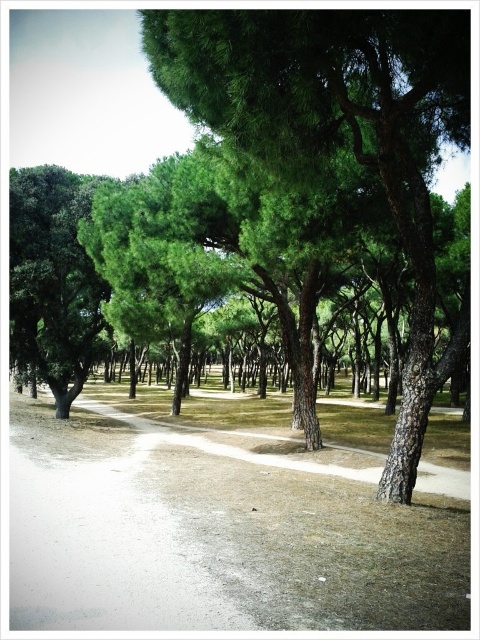
Question: Is dull gray concrete path at center above dirt path at center?

Choices:
 (A) yes
 (B) no

Answer: (A)

Question: Which point is closer to the camera taking this photo?

Choices:
 (A) (153, 424)
 (B) (100, 621)

Answer: (B)

Question: Can you confirm if dull gray concrete path at center is positioned to the right of dirt path at center?

Choices:
 (A) no
 (B) yes

Answer: (B)

Question: Among these objects, which one is nearest to the camera?

Choices:
 (A) dirt path at center
 (B) dull gray concrete path at center

Answer: (B)

Question: Is dull gray concrete path at center positioned at the back of dirt path at center?

Choices:
 (A) no
 (B) yes

Answer: (A)

Question: Which point is farther to the camera?

Choices:
 (A) (184, 408)
 (B) (188, 436)

Answer: (A)